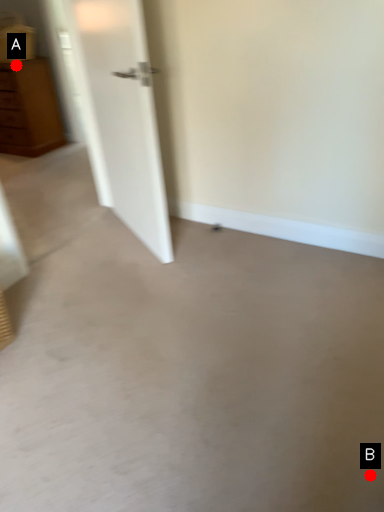
Question: Two points are circled on the image, labeled by A and B beside each circle. Which of the following is the farthest from the observer?

Choices:
 (A) A is further
 (B) B is further

Answer: (A)